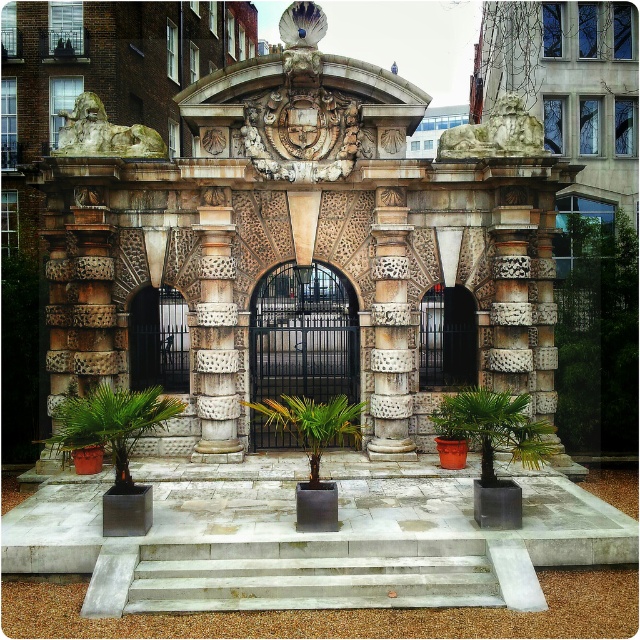
Is green leafy palm at lower left bigger than green leafy palm tree at center?

Yes.

Identify the location of green leafy palm at lower left. (112, 420).

Is concrete steps at center below marble column at center?

Indeed, concrete steps at center is positioned under marble column at center.

This screenshot has height=640, width=640. Describe the element at coordinates (312, 576) in the screenshot. I see `concrete steps at center` at that location.

Where is `concrete steps at center`? The image size is (640, 640). concrete steps at center is located at coordinates (312, 576).

Which is in front, point (470, 392) or point (436, 380)?

Point (470, 392) is in front.

Who is higher up, green leafy palm at center or dark metal gate at center?

dark metal gate at center is higher up.

This screenshot has height=640, width=640. What are the coordinates of `green leafy palm at center` in the screenshot? It's located at (493, 428).